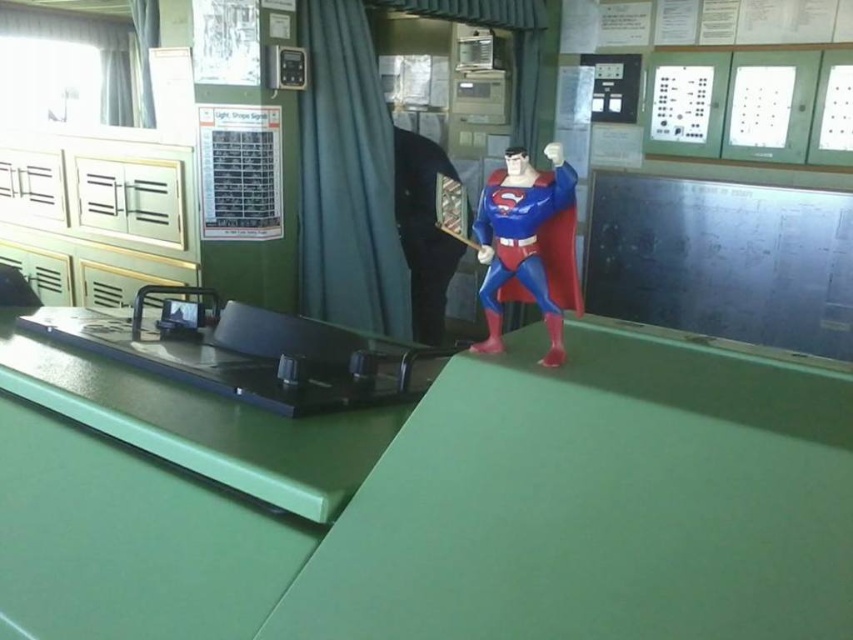
Does blue plastic superman figure at center come behind smooth black suit at center?

No, it is not.

Does blue plastic superman figure at center appear on the left side of smooth black suit at center?

No, blue plastic superman figure at center is not to the left of smooth black suit at center.

Locate an element on the screen. The height and width of the screenshot is (640, 853). blue plastic superman figure at center is located at coordinates (527, 244).